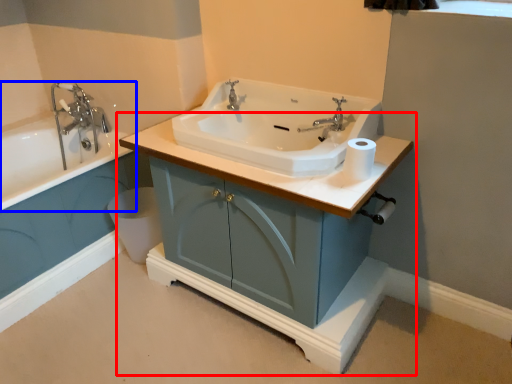
Question: Which of the following is the farthest to the observer, bathroom cabinet (highlighted by a red box) or bathtub (highlighted by a blue box)?

Choices:
 (A) bathroom cabinet
 (B) bathtub

Answer: (B)